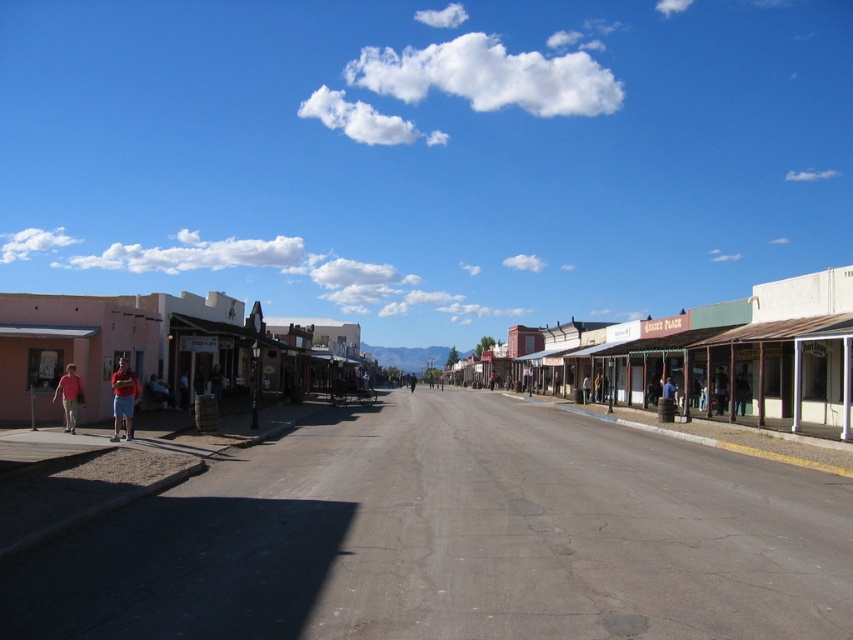
Between denim jacket at center and matte blue jeans at left, which one is positioned higher?

matte blue jeans at left is above.

Which is in front, point (721, 376) or point (161, 385)?

Point (161, 385) is more forward.

Is point (721, 378) closer to camera compared to point (155, 396)?

No, (721, 378) is further to viewer.

The image size is (853, 640). What are the coordinates of `denim jacket at center` in the screenshot? It's located at (718, 388).

Can you confirm if matte pink building at left is positioned above matte pink shirt at left?

Yes.

Can you confirm if matte pink building at left is shorter than matte pink shirt at left?

In fact, matte pink building at left may be taller than matte pink shirt at left.

Does point (103, 378) come closer to viewer compared to point (74, 400)?

No, it is not.

I want to click on matte pink building at left, so click(x=155, y=349).

Does matte pink building at left have a lesser height compared to brown leather jacket at center?

Incorrect, matte pink building at left's height does not fall short of brown leather jacket at center's.

Who is positioned more to the left, matte pink building at left or brown leather jacket at center?

matte pink building at left

Image resolution: width=853 pixels, height=640 pixels. I want to click on matte pink building at left, so click(155, 349).

This screenshot has height=640, width=853. Identify the location of matte pink building at left. (155, 349).